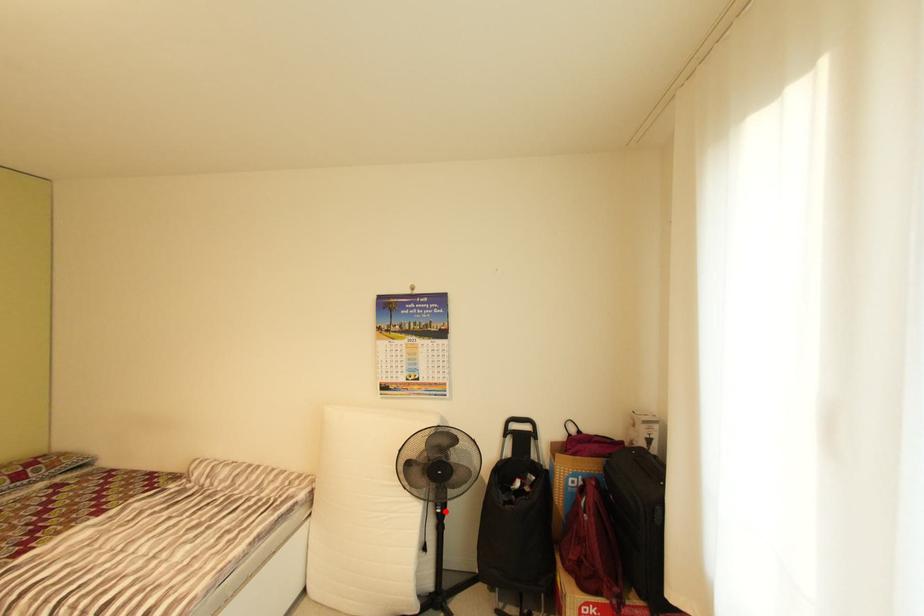
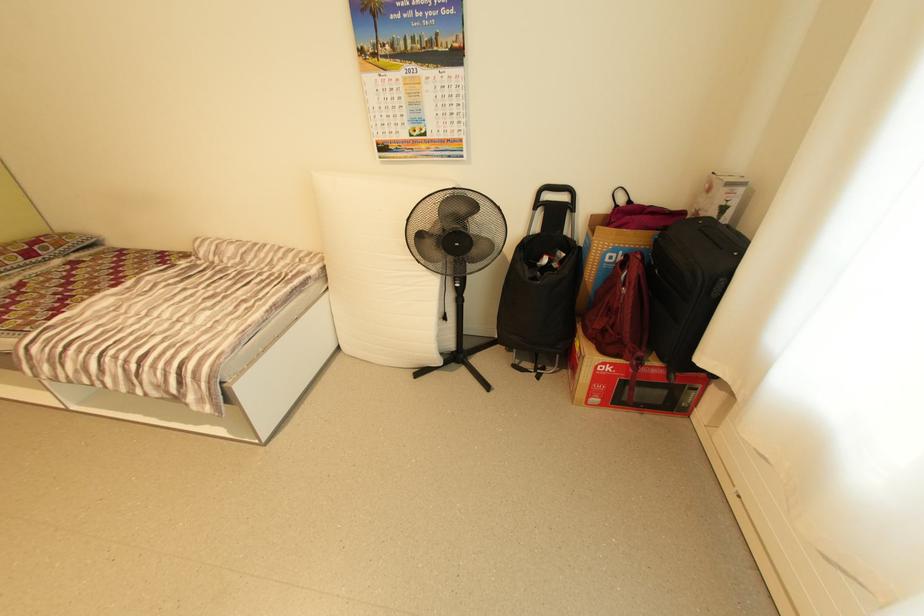
Find the pixel in the second image that matches the highlighted location in the first image.

(464, 286)